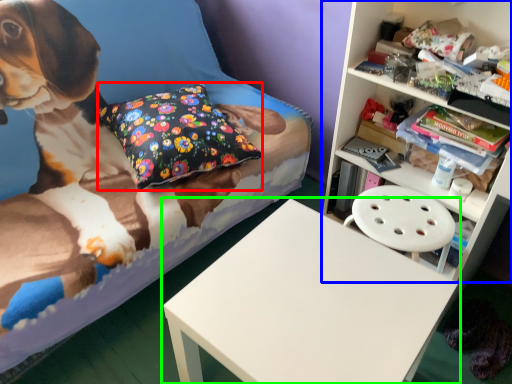
Question: Based on their relative distances, which object is nearer to pillow (highlighted by a red box)? Choose from shelf (highlighted by a blue box) and table (highlighted by a green box).

Choices:
 (A) shelf
 (B) table

Answer: (B)